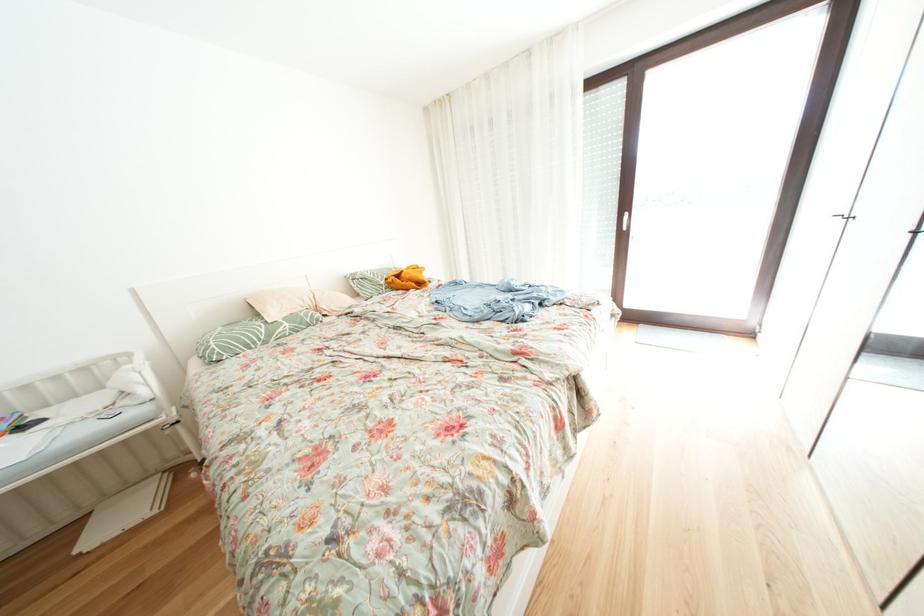
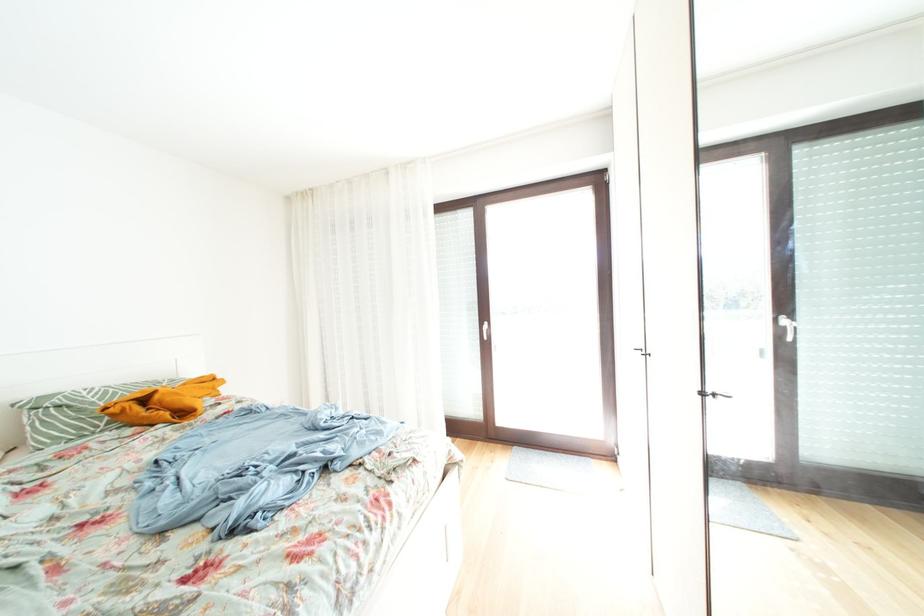
How did the camera likely rotate?

The camera rotated toward right-up.